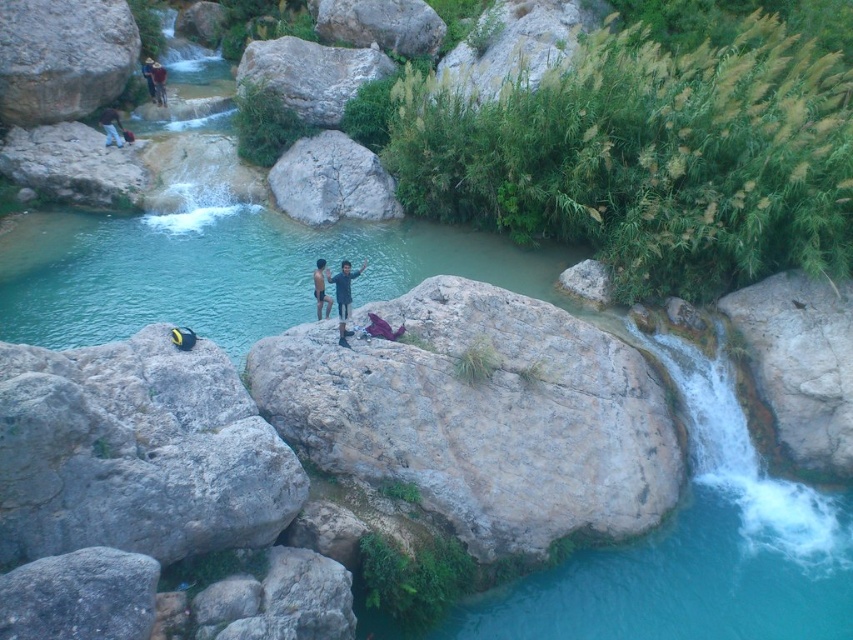
Question: Does smooth gray rock at upper left have a greater width compared to gray rough boulder at center?

Choices:
 (A) yes
 (B) no

Answer: (B)

Question: Which object is closer to the camera taking this photo?

Choices:
 (A) gray rough boulder at left
 (B) gray rough boulder at upper center

Answer: (A)

Question: Observing the image, what is the correct spatial positioning of dark skin human at center in reference to dark blue shirt at upper left?

Choices:
 (A) below
 (B) above

Answer: (A)

Question: Is gray rough rock at center positioned behind dark blue shirt at upper left?

Choices:
 (A) yes
 (B) no

Answer: (B)

Question: Which object is farther from the camera taking this photo?

Choices:
 (A) matte black shorts at upper left
 (B) gray rough boulder at left

Answer: (A)

Question: Which point is farther to the camera?

Choices:
 (A) brown leather jacket at upper left
 (B) dark blue shirt at upper left
 (C) matte black shorts at upper left

Answer: (A)